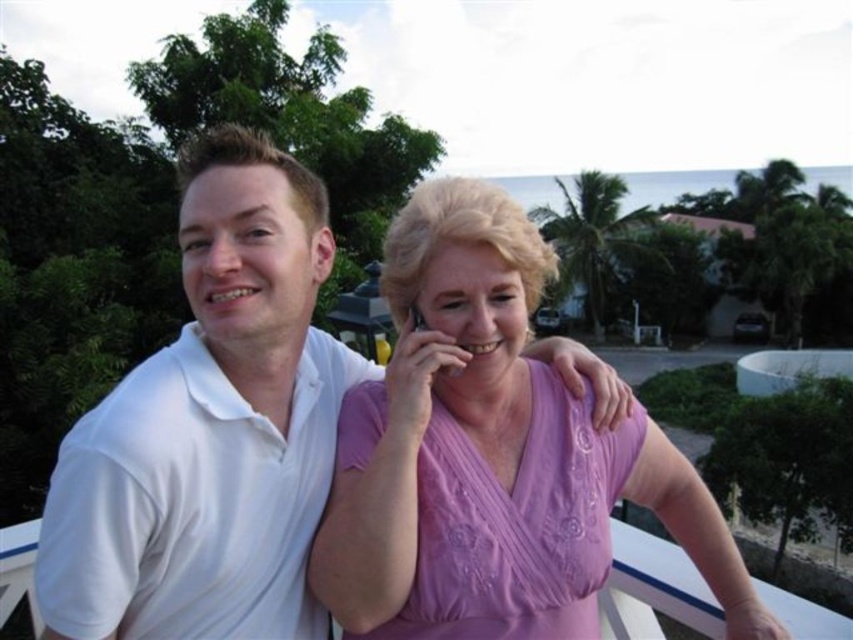
You are a photographer standing in front of the scene. You want to take a photo of the white smooth polo shirt at left without including the residential area in the background. Is it possible to do so by moving closer to the subject?

The white smooth polo shirt at left is 1.90 meters from the camera. Since the residential area is further back in the background, moving closer to the subject would allow you to focus on the shirt while cropping out the background. Yes, it is possible.

You are taking a photo of the two people in the scene. The camera is positioned so that you can see both individuals clearly. If you want to focus on the person closer to the camera, which point should you adjust the focus to? Please choose between point A and point B where point A is point (361, 380) and point B is point (418, 554).

Point A is further to the camera than point B. Therefore, to focus on the person closer to the camera, you should adjust the focus to point A.

You are a photographer trying to capture a closeup of the white smooth polo shirt at left. Based on the coordinates provided, where should you position your camera relative to the image frame?

Answer: The white smooth polo shirt at left is located at coordinates point [210,428], so you should position your camera to focus on that point to capture the closeup.